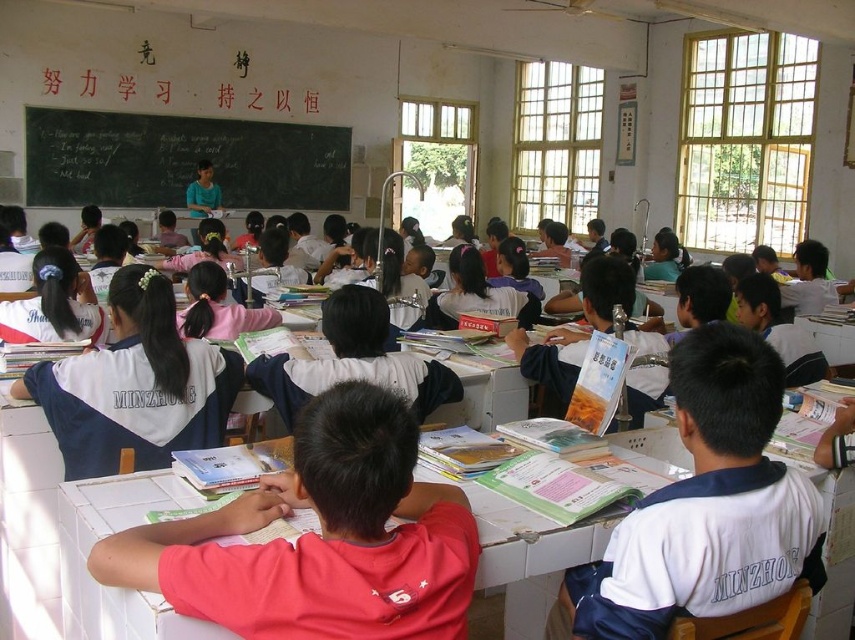
You are a student sitting at your desk in the classroom. You notice a point marked at coordinates (320,538). What object is located at that point?

The point at coordinates (320,538) marks the pink fabric shirt at center.

Consider the image. You are a student sitting at your desk in the classroom. You notice two points marked on the blackboard. The first point is at coordinate point(152, 570) and the second is at coordinate point(92, 486). Which point is closer to you?

Point(152, 570) is closer to you because it is closer to the camera than point(92, 486).

You are a teacher in the classroom and want to hand out a worksheet to the student wearing the pink fabric shirt at center and the student wearing the white matte uniform at center. If your arm can reach 20 inches, can you reach both students at the same time without moving your position?

The pink fabric shirt at center and white matte uniform at center are 21.68 inches apart from each other. Since the distance between them is greater than your arm reach of 20 inches, you cannot reach both students at the same time without moving your position.